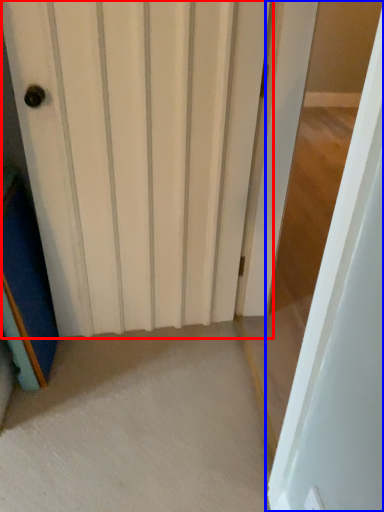
Question: Which object appears closest to the camera in this image, door (highlighted by a red box) or door (highlighted by a blue box)?

Choices:
 (A) door
 (B) door

Answer: (B)